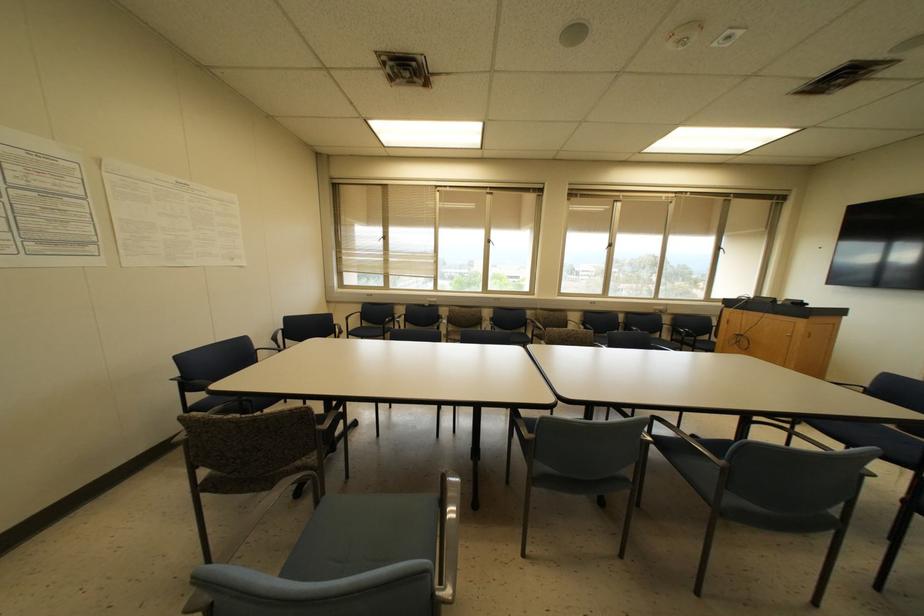
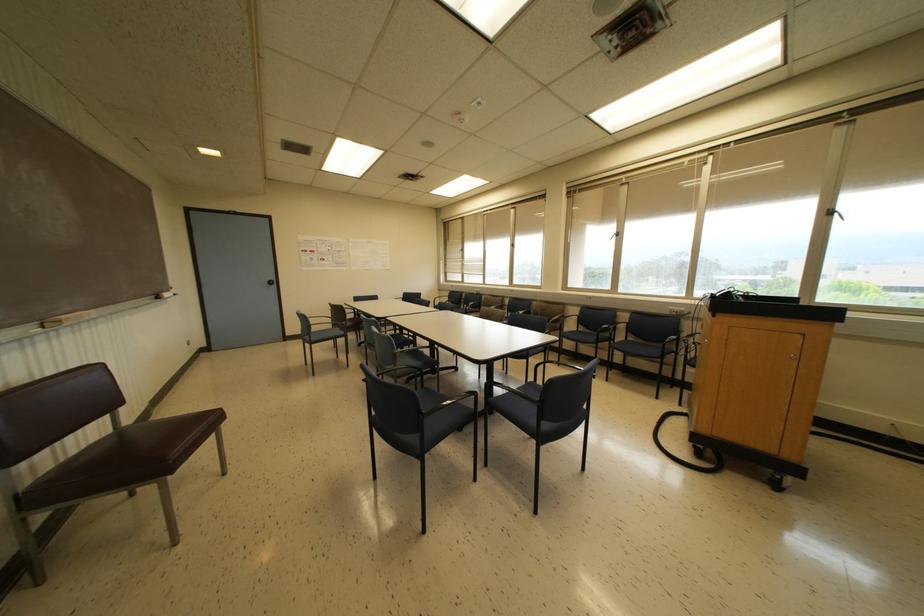
The point at (718, 248) is marked in the first image. Where is the corresponding point in the second image?

(827, 213)